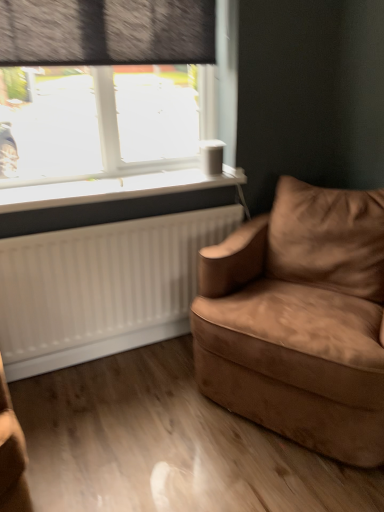
Question: Do you think transparent glass window at upper left is within suede brown armchair at right, or outside of it?

Choices:
 (A) outside
 (B) inside

Answer: (A)

Question: From a real-world perspective, is transparent glass window at upper left above or below suede brown armchair at right?

Choices:
 (A) below
 (B) above

Answer: (B)

Question: Considering the real-world distances, which object is farthest from the transparent glass window at upper left?

Choices:
 (A) white plastic window sill at upper left
 (B) suede brown armchair at right
 (C) dark gray textured curtain at upper left

Answer: (B)

Question: Estimate the real-world distances between objects in this image. Which object is farther from the transparent glass window at upper left?

Choices:
 (A) dark gray textured curtain at upper left
 (B) suede brown armchair at right
 (C) white plastic window sill at upper left

Answer: (B)